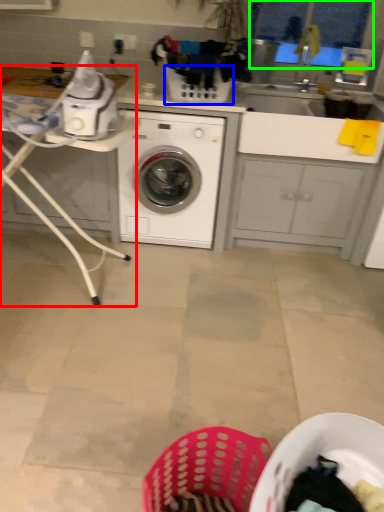
Question: Considering the real-world distances, which object is farthest from table (highlighted by a red box)? basket (highlighted by a blue box) or window screen (highlighted by a green box)?

Choices:
 (A) basket
 (B) window screen

Answer: (B)